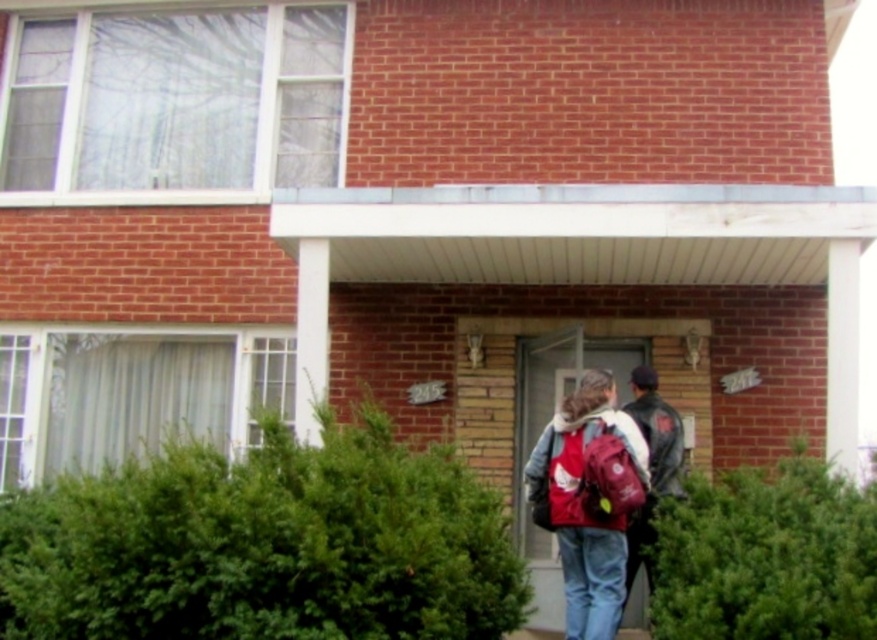
Question: Can you confirm if green leafy hedge at center is positioned above green leafy hedge at lower right?

Choices:
 (A) yes
 (B) no

Answer: (A)

Question: Does green leafy hedge at lower right appear on the left side of leather jacket at center?

Choices:
 (A) no
 (B) yes

Answer: (A)

Question: Which point is closer to the camera?

Choices:
 (A) (223, 589)
 (B) (624, 545)

Answer: (A)

Question: Based on their relative distances, which object is farther from the green leafy hedge at lower right?

Choices:
 (A) leather jacket at center
 (B) green leafy hedge at center
 (C) matte red backpack at center

Answer: (B)

Question: Among these points, which one is farthest from the camera?

Choices:
 (A) (674, 426)
 (B) (818, 464)

Answer: (A)

Question: Is green leafy hedge at center to the right of matte red backpack at center from the viewer's perspective?

Choices:
 (A) yes
 (B) no

Answer: (B)